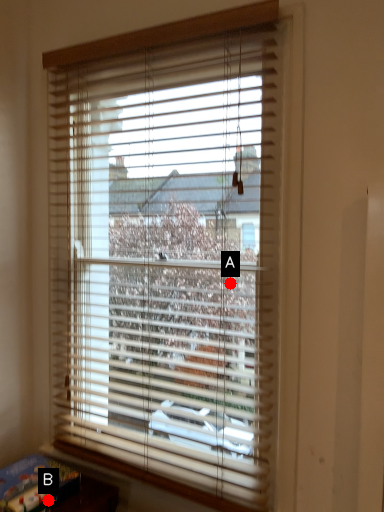
Question: Two points are circled on the image, labeled by A and B beside each circle. Which point is further to the camera?

Choices:
 (A) A is further
 (B) B is further

Answer: (A)